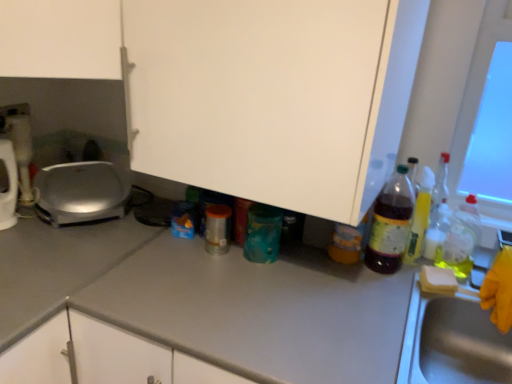
At what (x,y) coordinates should I click in order to perform the action: click on free space in front of teal matte canister at center, positioned as the 2th bottle in left-to-right order. Please return your answer as a coordinate pair (x, y). Image resolution: width=512 pixels, height=384 pixels. Looking at the image, I should click on (255, 284).